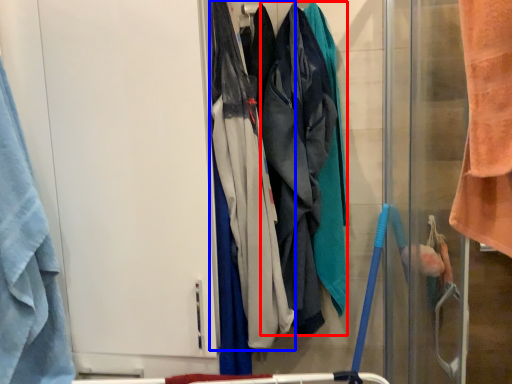
Question: Which point is closer to the camera, wide (highlighted by a red box) or wide (highlighted by a blue box)?

Choices:
 (A) wide
 (B) wide

Answer: (B)